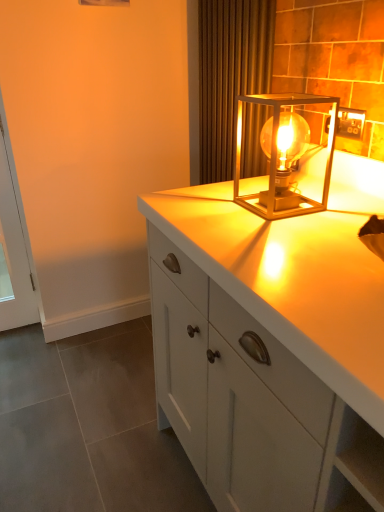
The width and height of the screenshot is (384, 512). Identify the location of free point in front of metallic gold lamp at upper right. (298, 231).